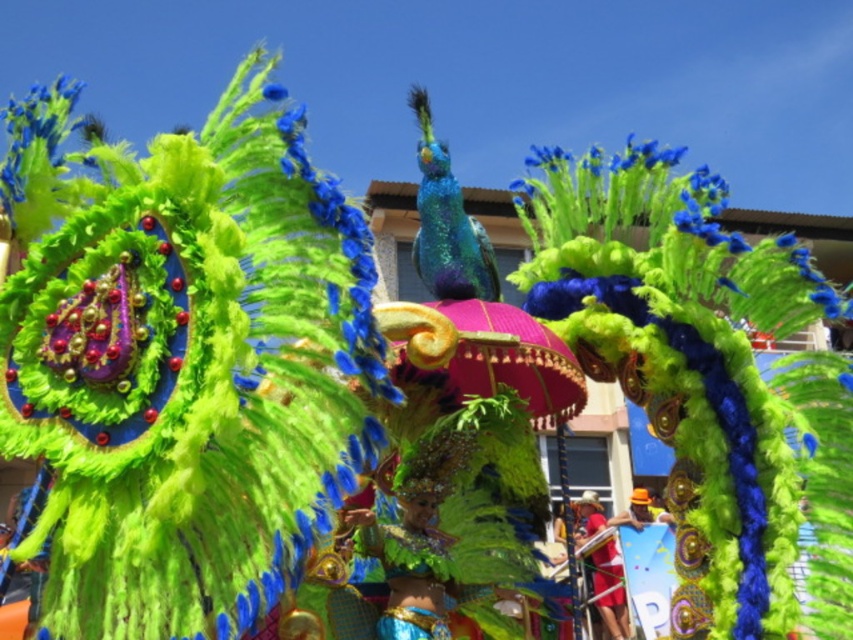
You are a photographer at the parade and want to capture both the shiny green costume at center and the red fabric at lower right in the same frame. Which object should you focus on first to ensure both are in focus?

The shiny green costume at center is thinner than the red fabric at lower right, so you should focus on the red fabric at lower right first because it is wider and will require a closer focus to ensure both are in focus.

You are a photographer positioned at the front of the float. You want to take a photo that clearly shows both the pink satin umbrella at center and the shiny metallic helmet at center. Which object will appear larger in your photo?

The pink satin umbrella at center will appear larger in the photo because it is closer to the viewer than the shiny metallic helmet at center.

You are a photographer at the parade and want to capture the pink satin umbrella at center and the shiny green costume at center in a single shot. Which object should you focus on first to ensure both are in frame?

The pink satin umbrella at center is above the shiny green costume at center, so you should focus on the shiny green costume at center first to ensure both are in frame.